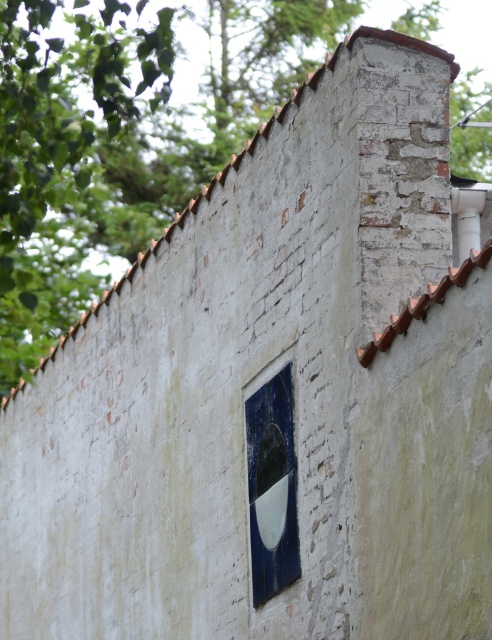
Who is positioned more to the left, green leafy tree at upper left or blue glossy tile at center?

From the viewer's perspective, green leafy tree at upper left appears more on the left side.

Is point (239, 109) positioned in front of point (277, 564)?

No, (239, 109) is behind (277, 564).

The image size is (492, 640). In order to click on green leafy tree at upper left in this screenshot , I will do `click(122, 140)`.